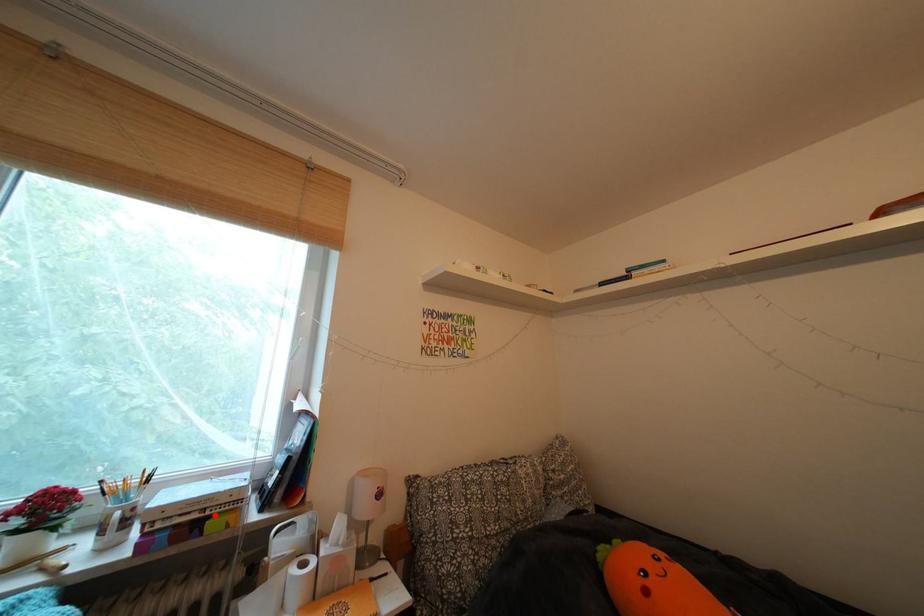
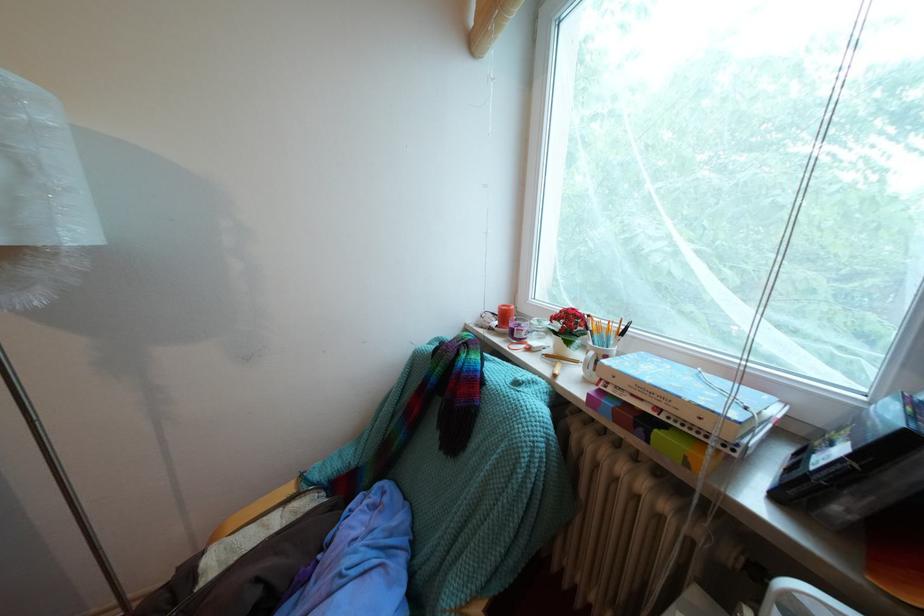
The point at the highlighted location is marked in the first image. Where is the corresponding point in the second image?

(669, 415)